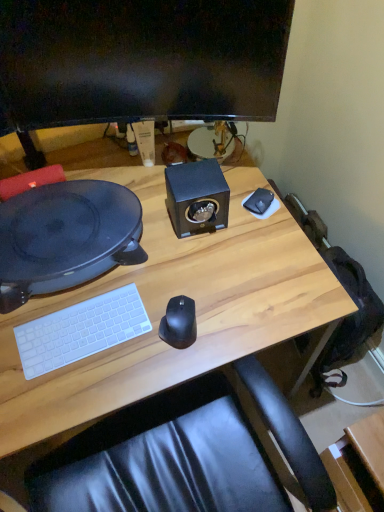
You are a GUI agent. You are given a task and a screenshot of the screen. Output one action in this format:
    pyautogui.click(x=<x>, y=<y>)
    Task: Click on the vacant space in front of black matte speaker at center
    
    Given the screenshot: What is the action you would take?
    pyautogui.click(x=199, y=269)